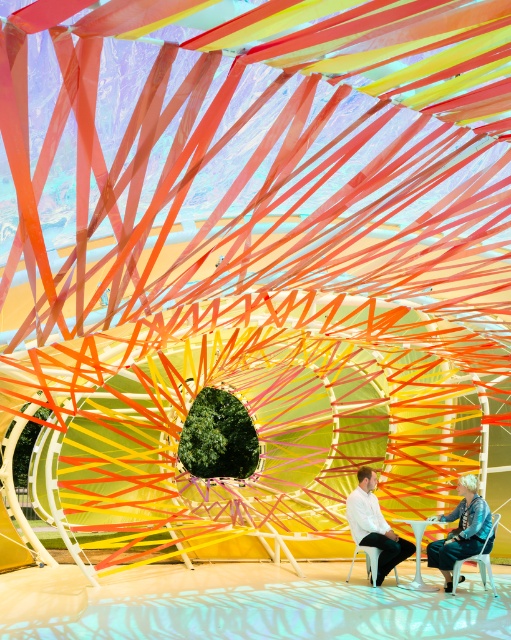
Between denim jacket at lower right and white plastic chair at lower right, which one has more height?

denim jacket at lower right is taller.

Where is `denim jacket at lower right`? This screenshot has width=511, height=640. denim jacket at lower right is located at coordinates (460, 529).

The width and height of the screenshot is (511, 640). Describe the element at coordinates (460, 529) in the screenshot. I see `denim jacket at lower right` at that location.

Between denim jacket at lower right and white glossy chair at center, which one has less height?

With less height is denim jacket at lower right.

I want to click on denim jacket at lower right, so click(460, 529).

Who is more distant from viewer, (365,540) or (359,550)?

Positioned behind is point (359,550).

Who is more forward, (375, 480) or (396, 579)?

Positioned in front is point (396, 579).

Locate an element on the screen. The width and height of the screenshot is (511, 640). white glossy chair at center is located at coordinates (374, 524).